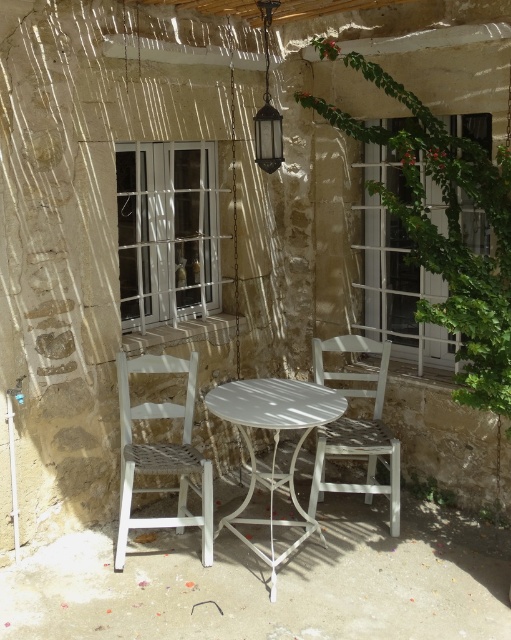
Question: Among these points, which one is nearest to the camera?

Choices:
 (A) (337, 428)
 (B) (173, 410)
 (C) (258, 148)

Answer: (B)

Question: Does white metal table at center have a smaller size compared to white wood chair at center?

Choices:
 (A) yes
 (B) no

Answer: (B)

Question: Estimate the real-world distances between objects in this image. Which object is farther from the white woven chair at left?

Choices:
 (A) white metal table at center
 (B) white wood chair at center
 (C) matte glass lantern at upper center

Answer: (C)

Question: Among these points, which one is nearest to the camera?

Choices:
 (A) (292, 545)
 (B) (345, 488)

Answer: (A)

Question: Can you confirm if white woven chair at left is positioned to the left of white wood chair at center?

Choices:
 (A) yes
 (B) no

Answer: (A)

Question: Considering the relative positions of white woven chair at left and white metal table at center in the image provided, where is white woven chair at left located with respect to white metal table at center?

Choices:
 (A) above
 (B) below

Answer: (A)